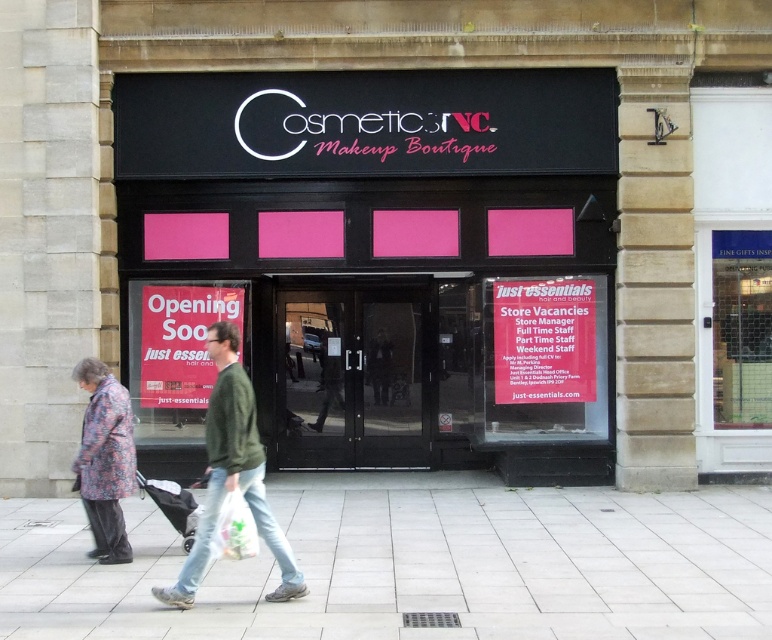
You are a customer entering the store and see the green cotton jacket at center and the floral fabric coat at lower left displayed in the window. Which one is bigger?

The green cotton jacket at center is larger in size than the floral fabric coat at lower left, so the green cotton jacket at center is bigger.

You are a delivery person arriving at the Cosmetics Inc. Makeup Boutique. You need to place a heavy box on the ground near the entrance. The black matte signboard at center is in the way. Can you move the box to the smooth concrete pavement at lower center without moving the signboard?

The black matte signboard at center is above the smooth concrete pavement at lower center, so you can place the box on the smooth concrete pavement at lower center because it is located below the signboard and not obstructed by it.

You are standing in front of the Cosmetics Inc. Makeup Boutique. You see the smooth concrete pavement at lower center and the green cotton jacket at center. Which object is closer to you?

The smooth concrete pavement at lower center is closer to you because it is further to the viewer than the green cotton jacket at center.